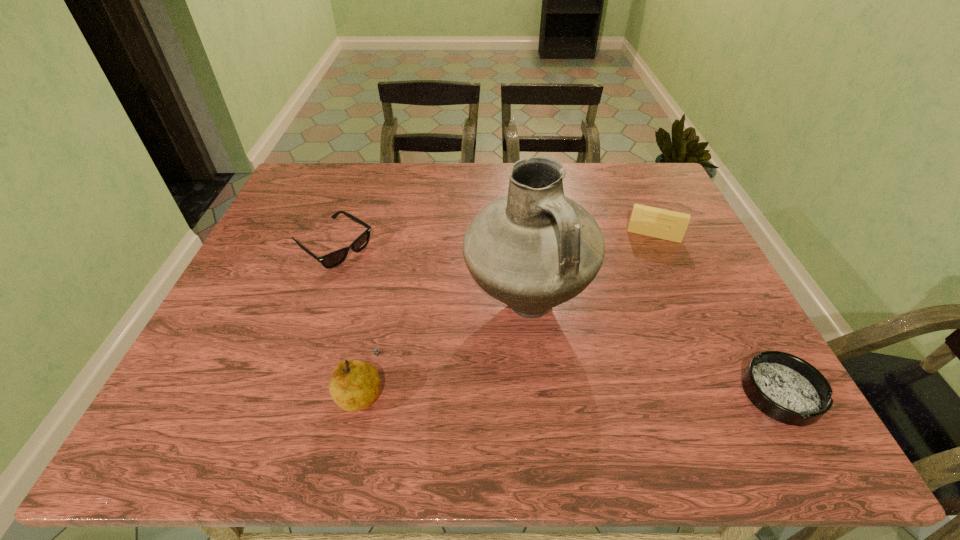
At what (x,y) coordinates should I click in order to perform the action: click on vacant space at the near left corner. Please return your answer as a coordinate pair (x, y). This screenshot has height=540, width=960. Looking at the image, I should click on (185, 385).

In the image, there is a desktop. Find the location of `free space at the far right corner`. free space at the far right corner is located at coordinates (662, 203).

Where is `empty space that is in between the third object from right to left and the ashtray`? empty space that is in between the third object from right to left and the ashtray is located at coordinates (654, 349).

I want to click on unoccupied area between the pear and the pitcher, so click(444, 347).

Where is `empty space between the pitcher and the sunglasses`? This screenshot has width=960, height=540. empty space between the pitcher and the sunglasses is located at coordinates (430, 276).

I want to click on vacant point located between the ashtray and the pitcher, so 654,349.

Identify the location of empty space between the shortest object and the leftmost object. (557, 320).

Locate an element on the screen. This screenshot has height=540, width=960. vacant area between the leftmost object and the ashtray is located at coordinates (557, 320).

Where is `vacant space that is in between the ashtray and the third object from right to left`? vacant space that is in between the ashtray and the third object from right to left is located at coordinates (654, 349).

The image size is (960, 540). What are the coordinates of `empty space that is in between the ashtray and the leftmost object` in the screenshot? It's located at tap(557, 320).